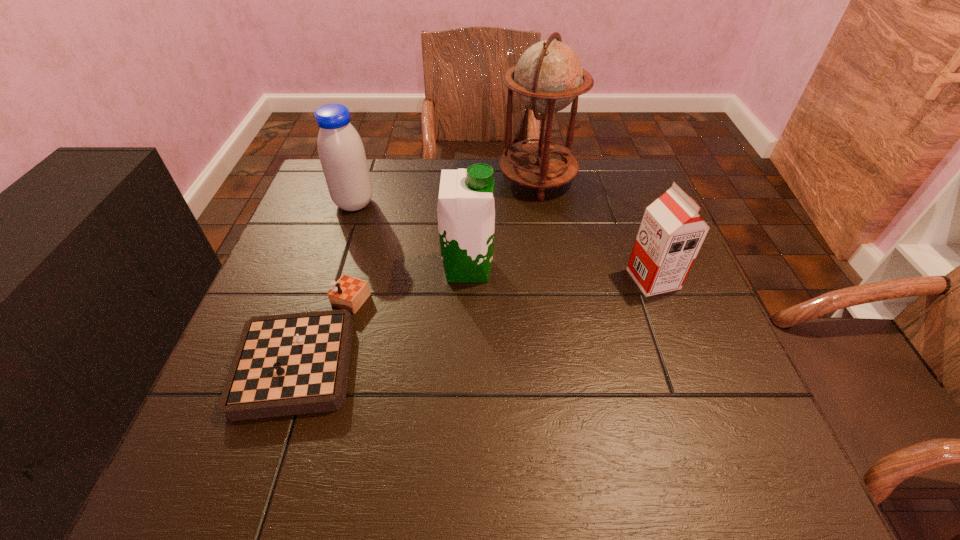
At what (x,y) coordinates should I click in order to perform the action: click on vacant region located on the front-facing side of the third object from right to left. Please return your answer as a coordinate pair (x, y). This screenshot has width=960, height=540. Looking at the image, I should click on (593, 268).

At what (x,y) coordinates should I click in order to perform the action: click on vacant space located 0.360m on the front of the rightmost soya milk. Please return your answer as a coordinate pair (x, y). The width and height of the screenshot is (960, 540). Looking at the image, I should click on (724, 465).

Locate an element on the screen. The width and height of the screenshot is (960, 540). free space located on the back of the shortest object is located at coordinates (350, 204).

Identify the location of globe that is at the far edge. This screenshot has height=540, width=960. (547, 78).

I want to click on soya milk situated at the far edge, so click(x=342, y=155).

Identify the location of soya milk positioned at the left edge. Image resolution: width=960 pixels, height=540 pixels. (342, 155).

Where is `chessboard that is at the left edge`? This screenshot has height=540, width=960. chessboard that is at the left edge is located at coordinates (289, 364).

Find the location of `object at the right edge`. object at the right edge is located at coordinates (671, 233).

What are the coordinates of `object at the far left corner` in the screenshot? It's located at (342, 155).

In the image, there is a desktop. Where is `vacant region at the far edge`? vacant region at the far edge is located at coordinates (404, 195).